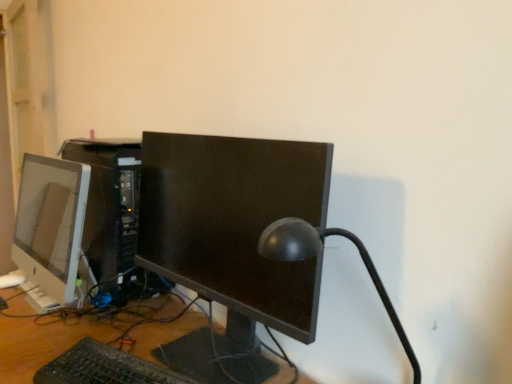
Question: Is satin white monitor at left, which is counted as the second computer monitor, starting from the right, outside satin black computer tower at center?

Choices:
 (A) yes
 (B) no

Answer: (A)

Question: Is satin white monitor at left, arranged as the first computer monitor when viewed from the left, aimed at satin black computer tower at center?

Choices:
 (A) yes
 (B) no

Answer: (A)

Question: From a real-world perspective, is satin white monitor at left, arranged as the first computer monitor when viewed from the left, under satin black computer tower at center?

Choices:
 (A) yes
 (B) no

Answer: (A)

Question: Is satin white monitor at left, which is counted as the second computer monitor, starting from the right, not close to satin black computer tower at center?

Choices:
 (A) no
 (B) yes

Answer: (B)

Question: Does satin white monitor at left, arranged as the first computer monitor when viewed from the left, have a larger size compared to satin black computer tower at center?

Choices:
 (A) no
 (B) yes

Answer: (A)

Question: In terms of height, does matte black monitor at center, the second computer monitor from the left, look taller or shorter compared to black plastic keyboard at lower center?

Choices:
 (A) short
 (B) tall

Answer: (B)

Question: From a real-world perspective, is matte black monitor at center, which ranks as the first computer monitor in right-to-left order, physically located above or below black plastic keyboard at lower center?

Choices:
 (A) above
 (B) below

Answer: (A)

Question: Considering the positions of point (215, 281) and point (51, 382), is point (215, 281) closer or farther from the camera than point (51, 382)?

Choices:
 (A) farther
 (B) closer

Answer: (A)

Question: Is matte black monitor at center, the second computer monitor from the left, to the left or to the right of black plastic keyboard at lower center in the image?

Choices:
 (A) left
 (B) right

Answer: (B)

Question: In the image, is wooden desk at center positioned in front of or behind black plastic keyboard at lower center?

Choices:
 (A) behind
 (B) front

Answer: (B)

Question: From their relative heights in the image, would you say wooden desk at center is taller or shorter than black plastic keyboard at lower center?

Choices:
 (A) tall
 (B) short

Answer: (A)

Question: Would you say wooden desk at center is inside or outside black plastic keyboard at lower center?

Choices:
 (A) outside
 (B) inside

Answer: (A)

Question: Is point (167, 337) positioned closer to the camera than point (153, 380)?

Choices:
 (A) closer
 (B) farther

Answer: (B)

Question: Which is correct: satin black lamp at center is inside satin black computer tower at center, or outside of it?

Choices:
 (A) outside
 (B) inside

Answer: (A)

Question: In terms of width, does satin black lamp at center look wider or thinner when compared to satin black computer tower at center?

Choices:
 (A) thin
 (B) wide

Answer: (B)